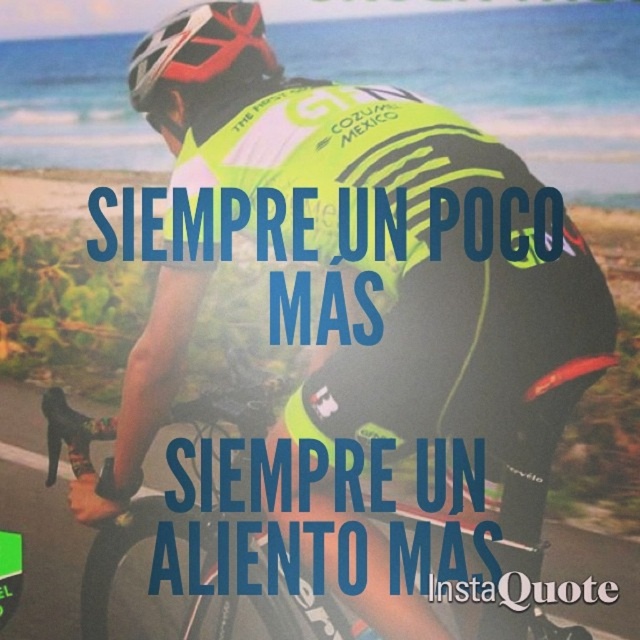
You are a photographer standing on the coastal road and want to take a photo of the cyclist. The camera you have can only focus on objects within 2 meters. Will the matte black helmet at upper center be in focus?

The matte black helmet at upper center is 2.32 meters away from the viewer, which is beyond the camera focus range of 2 meters. Therefore, the helmet will not be in focus.

You are an AI analyzing an image of a cyclist. The cyclist is wearing a bright yellow and black jersey with a helmet. Where exactly is the matte black helmet at upper center located in terms of coordinates?

The matte black helmet at upper center is located at coordinates point (198,52).

Based on the photo, you are a photographer trying to capture the cyclist from behind. You notice the matte black helmet at upper center and the neon yellow fabric at center. Which object should you focus on first to ensure the cyclist remains in frame?

The matte black helmet at upper center is in front of the neon yellow fabric at center, so you should focus on the matte black helmet at upper center first to keep the cyclist in frame as they move forward.